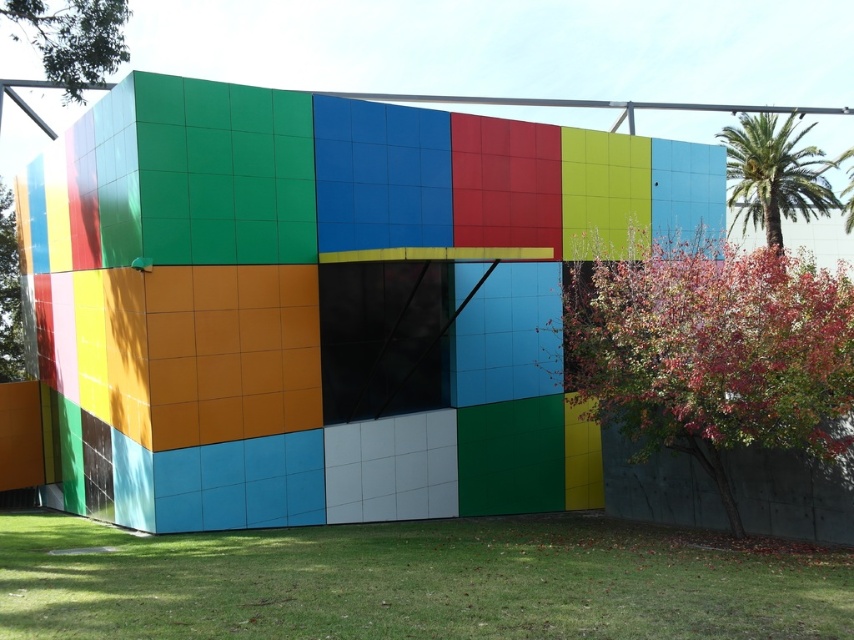
Locate an element on the screen. Image resolution: width=854 pixels, height=640 pixels. green grass at lower center is located at coordinates (414, 582).

Between point (428, 538) and point (822, 186), which one is positioned behind?

Positioned behind is point (822, 186).

Does point (273, 588) lie in front of point (761, 176)?

Yes, it is.

Where is `green grass at lower center`? The image size is (854, 640). green grass at lower center is located at coordinates (414, 582).